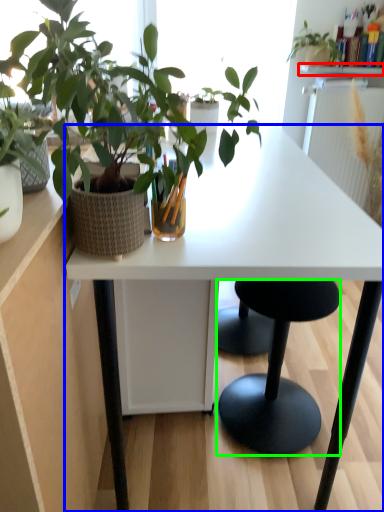
Question: Which is farther away from window sill (highlighted by a red box)? desk (highlighted by a blue box) or stool (highlighted by a green box)?

Choices:
 (A) desk
 (B) stool

Answer: (B)